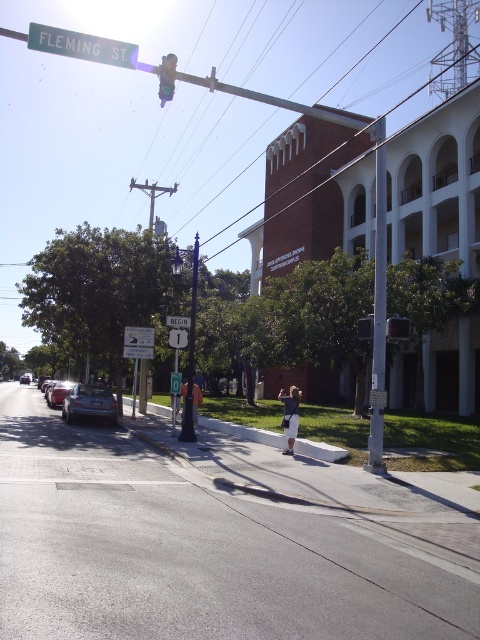
You are a delivery person trying to park your 1.8 meters wide van. You see the metallic silver sedan at lower left and the green glass traffic light at upper center. Can you safely park your van between them without hitting either?

The metallic silver sedan at lower left might be wider than the green glass traffic light at upper center. Since the van is 1.8 meters wide, it is uncertain if there is enough space between them. Check the actual width before parking.

You are a delivery driver who needs to park your truck on the smooth asphalt road at center. The truck requires a parking space that is at least as tall as the metallic traffic light at center. Can you park your truck there?

The smooth asphalt road at center is taller than the metallic traffic light at center, so yes, the truck can park there as the road meets the height requirement.